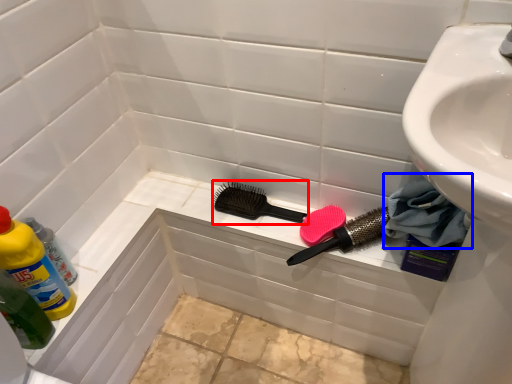
Question: Which point is further to the camera, brush (highlighted by a red box) or material (highlighted by a blue box)?

Choices:
 (A) brush
 (B) material

Answer: (A)